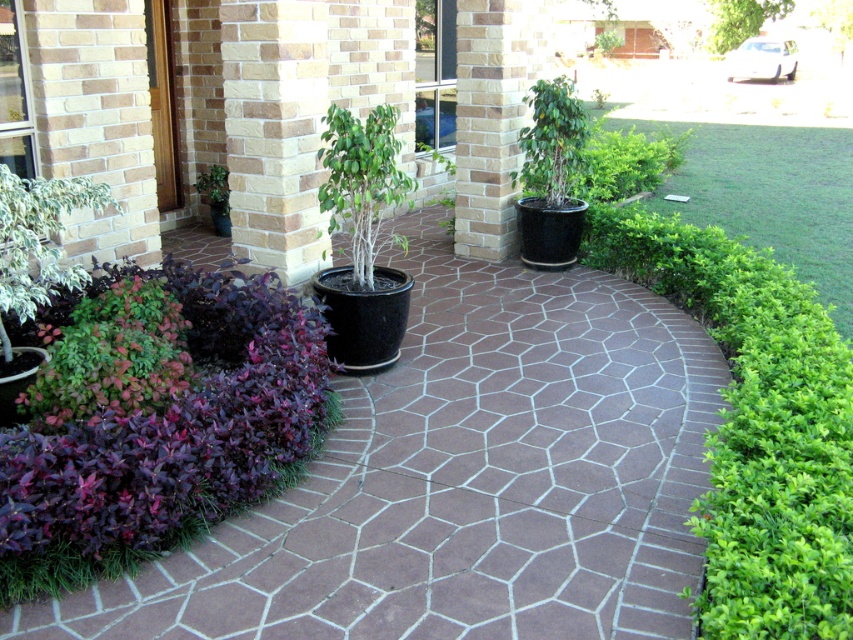
Does purple leafy plant at lower left have a greater width compared to green glossy bush at left?

Yes.

What do you see at coordinates (170, 442) in the screenshot?
I see `purple leafy plant at lower left` at bounding box center [170, 442].

Is point (196, 506) positioned behind point (38, 211)?

No, (196, 506) is in front of (38, 211).

At what (x,y) coordinates should I click in order to perform the action: click on purple leafy plant at lower left. Please return your answer as a coordinate pair (x, y). Looking at the image, I should click on coord(170,442).

Is point (288, 532) in front of point (20, 288)?

Yes, point (288, 532) is in front of point (20, 288).

Who is more forward, (480, 566) or (51, 252)?

Point (480, 566) is more forward.

Does point (657, 353) come in front of point (10, 253)?

No, it is behind (10, 253).

Image resolution: width=853 pixels, height=640 pixels. Identify the location of brown textured paving at center. (463, 481).

This screenshot has width=853, height=640. What do you see at coordinates (361, 180) in the screenshot? I see `green matte tree at center` at bounding box center [361, 180].

Does green matte tree at center appear on the left side of green leafy bush at upper center?

Yes, green matte tree at center is to the left of green leafy bush at upper center.

Which is in front, point (334, 182) or point (660, 145)?

Point (334, 182) is more forward.

The image size is (853, 640). I want to click on green matte tree at center, so click(x=361, y=180).